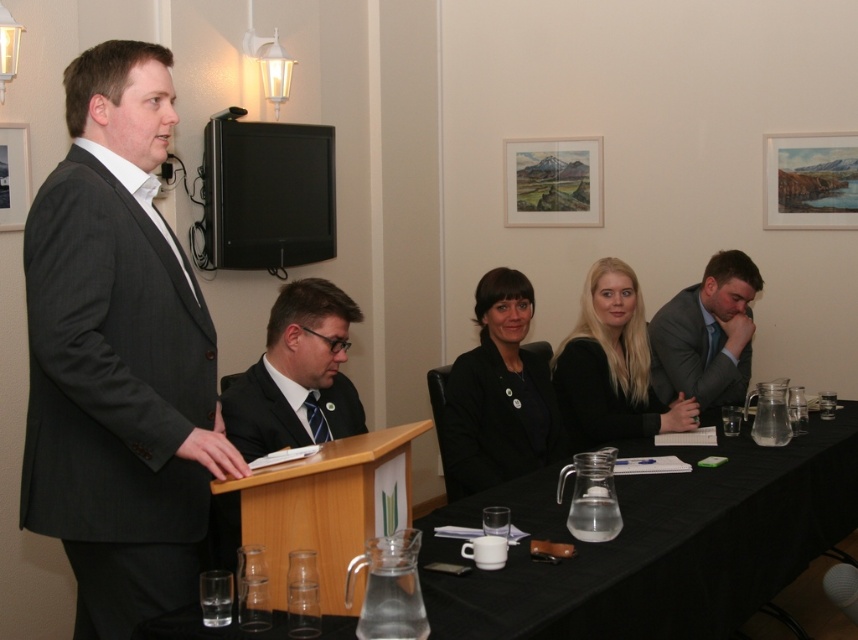
You are standing in the room and want to approach the wooden podium at center. Which direction should you move to reach it?

The wooden podium at center is located at point coordinates 0.794 on the x axis and 0.383 on the y axis. Since the podium is at center, you should move towards the central area of the room to reach it.

You are a guest at this meeting and need to identify the clothing items worn by the presenter standing behind the podium. Which item is closer to the podium, the black matte jacket at center or the matte black suit at center?

The black matte jacket at center is positioned under the matte black suit at center, so the black matte jacket at center is closer to the podium.